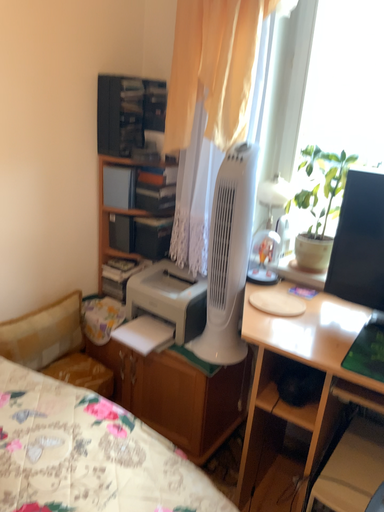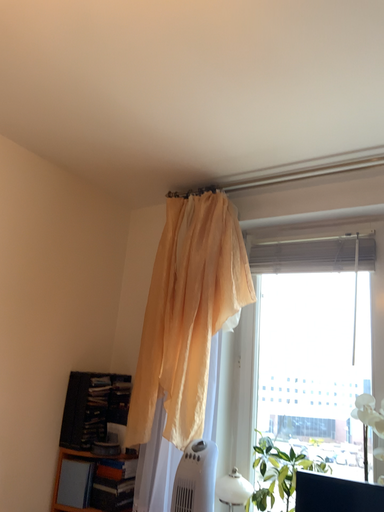
Question: Which way did the camera rotate in the video?

Choices:
 (A) rotated upward
 (B) rotated downward

Answer: (A)